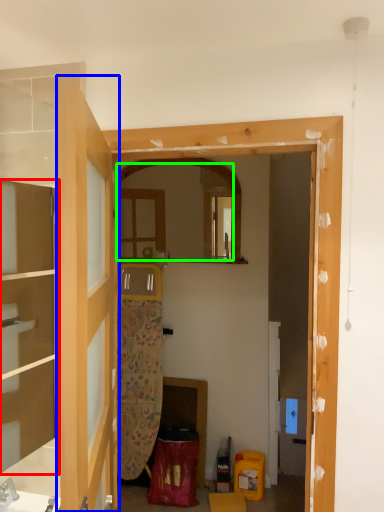
Question: Estimate the real-world distances between objects in this image. Which object is closer to cabinetry (highlighted by a red box), door (highlighted by a blue box) or mirror (highlighted by a green box)?

Choices:
 (A) door
 (B) mirror

Answer: (A)